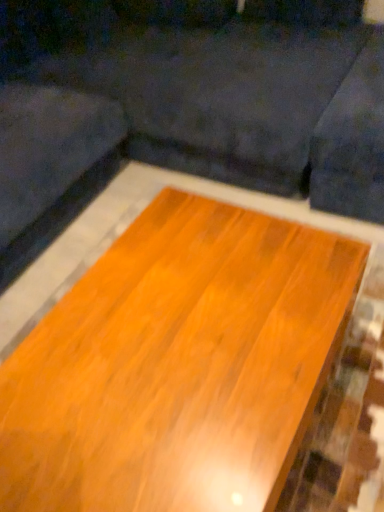
Identify the location of free spot above shiny wood table at center (from a real-world perspective). (166, 335).